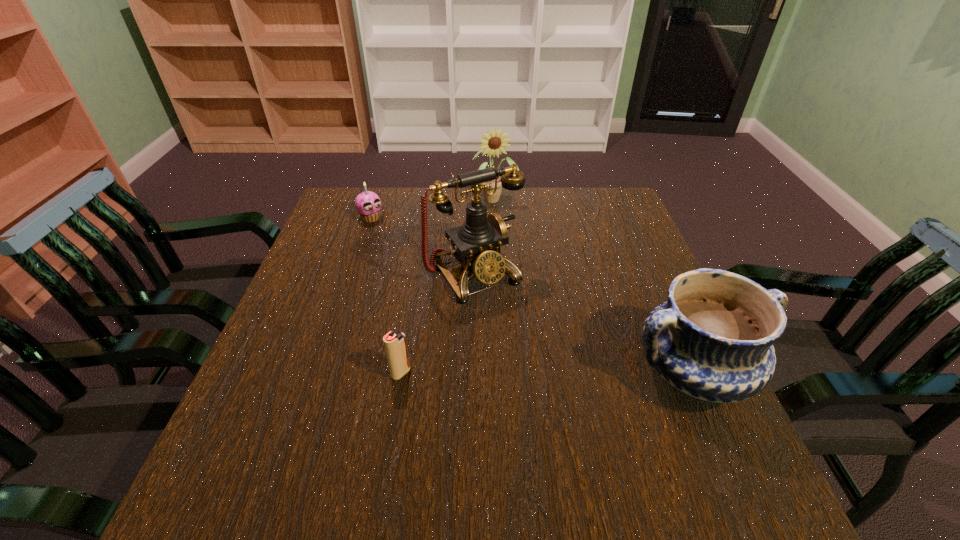
The width and height of the screenshot is (960, 540). I want to click on vacant space on the desktop that is between the igniter and the rightmost object and is positioned on the front of the third farthest object, featuring the rotary dial, so pos(547,373).

Locate an element on the screen. free space on the desktop that is between the igniter and the third shortest object and is positioned on the face of the leftmost object is located at coordinates (544, 373).

Find the location of `free space on the desktop that is between the fourth object from right to left and the third shortest object and is positioned on the front-facing side of the second tallest object`. free space on the desktop that is between the fourth object from right to left and the third shortest object and is positioned on the front-facing side of the second tallest object is located at coordinates (559, 373).